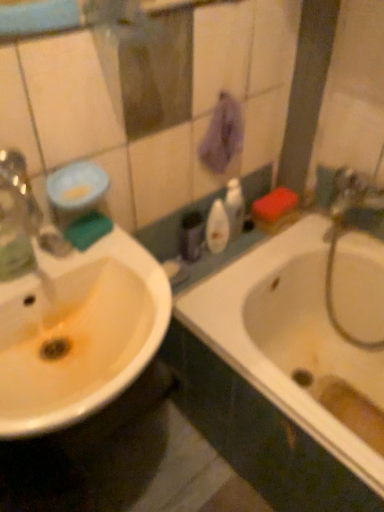
Where is `vacant space in front of white glossy bottle at center, the 2th toiletry from the left`? vacant space in front of white glossy bottle at center, the 2th toiletry from the left is located at coordinates (218, 264).